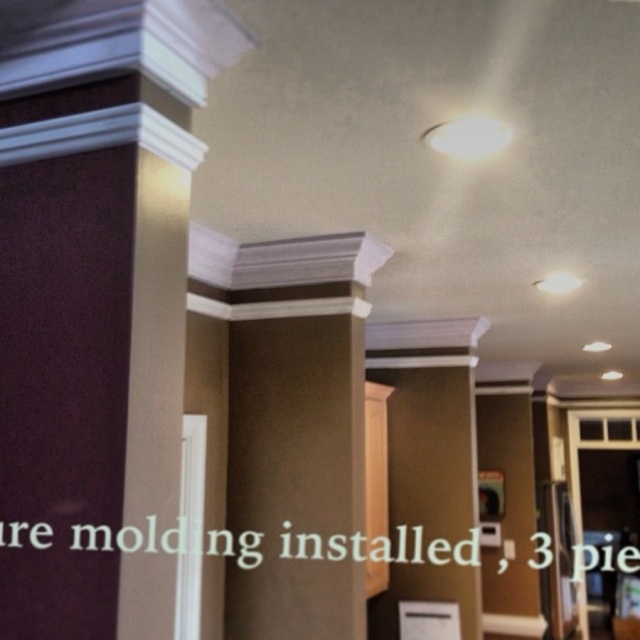
Question: Can you confirm if white glossy column at upper left is positioned to the right of white glossy crown molding at upper center?

Choices:
 (A) yes
 (B) no

Answer: (B)

Question: Is white glossy column at upper left further to camera compared to white glossy crown molding at upper center?

Choices:
 (A) yes
 (B) no

Answer: (B)

Question: Does white glossy column at upper left appear over white glossy crown molding at upper center?

Choices:
 (A) no
 (B) yes

Answer: (B)

Question: Which point is farther to the camera?

Choices:
 (A) (262, 369)
 (B) (173, 154)

Answer: (A)